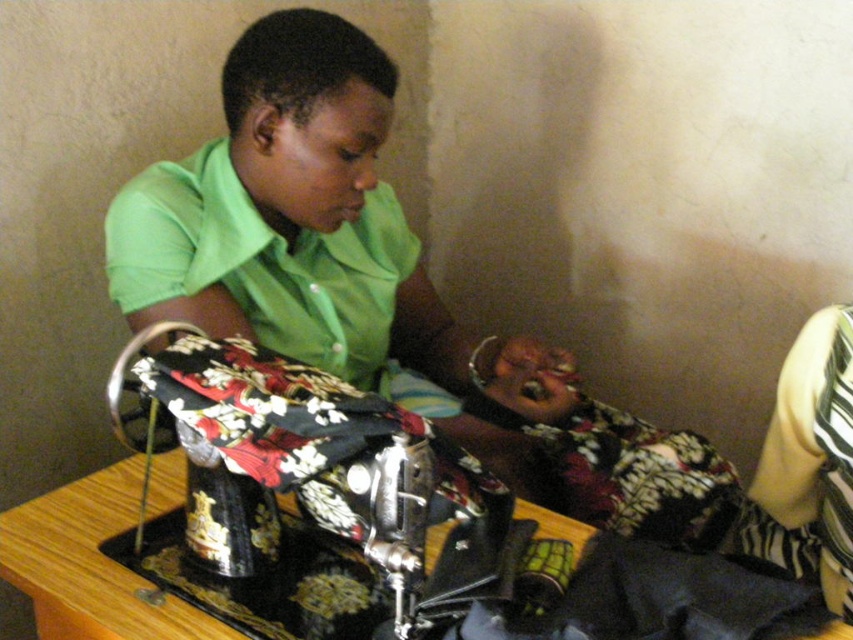
You are standing in the room and see the sewing machine at the table. There is a point marked at coordinates (306, 227). What object is this point located on?

The point at coordinates (306, 227) is located on the green matte shirt at center.

Based on the scene description, can you determine the spatial relationship between the green matte shirt at center and the yellow striped fabric at right? Specifically, is the green matte shirt located above or below the yellow striped fabric?

The green matte shirt at center is above the yellow striped fabric at right according to the description.